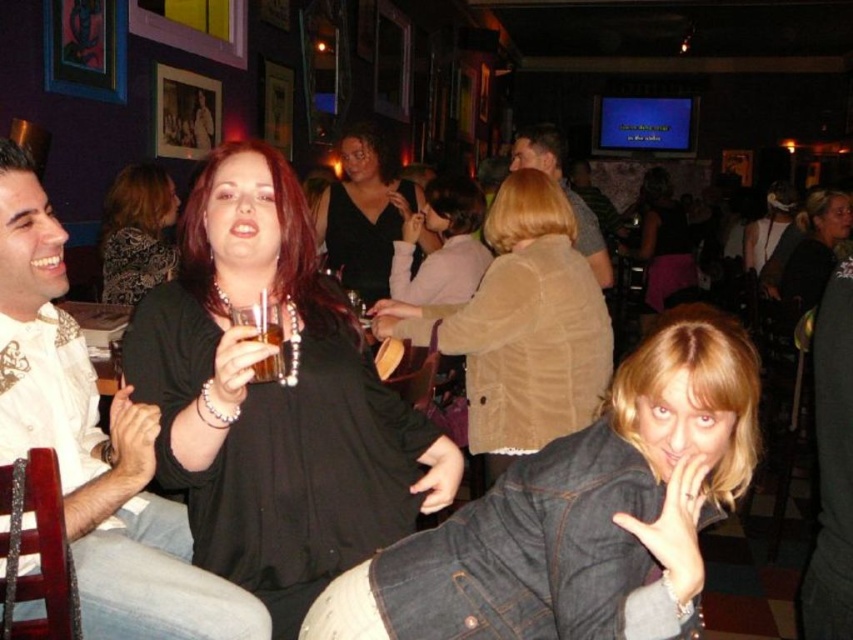
You are standing at the entrance of the bar and want to find the black velvet dress at center. According to the coordinates given, in which direction should you look to locate it?

The black velvet dress at center is located at coordinates point (364, 212), which is to the left and slightly below the center of the image.

You are a photographer at the event and want to capture both the black velvet dress at center and the matte black dress at center in the same photo. Which dress will appear lower in the frame?

The black velvet dress at center is positioned under the matte black dress at center, so it will appear lower in the frame.